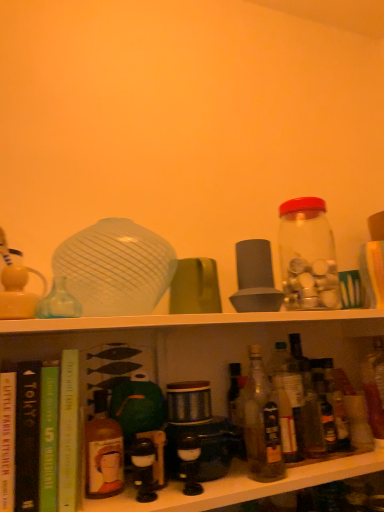
Question: From a real-world perspective, is hardcover book at left, which is counted as the 1th book, starting from the left, under translucent glass bottle at center, which appears as the 2th bottle when viewed from the right?

Choices:
 (A) no
 (B) yes

Answer: (A)

Question: Considering the relative positions of hardcover book at left, which is counted as the 1th book, starting from the left, and translucent glass bottle at center, marked as the fourth bottle in a left-to-right arrangement, in the image provided, is hardcover book at left, which is counted as the 1th book, starting from the left, in front of translucent glass bottle at center, marked as the fourth bottle in a left-to-right arrangement,?

Choices:
 (A) yes
 (B) no

Answer: (A)

Question: Is hardcover book at left, placed as the fourth book when sorted from right to left, oriented towards translucent glass bottle at center, which appears as the 2th bottle when viewed from the right?

Choices:
 (A) yes
 (B) no

Answer: (B)

Question: From the image's perspective, does hardcover book at left, which is counted as the 1th book, starting from the left, appear lower than translucent glass bottle at center, which appears as the 2th bottle when viewed from the right?

Choices:
 (A) yes
 (B) no

Answer: (B)

Question: From a real-world perspective, is hardcover book at left, placed as the fourth book when sorted from right to left, located higher than translucent glass bottle at center, which appears as the 2th bottle when viewed from the right?

Choices:
 (A) yes
 (B) no

Answer: (A)

Question: Does hardcover book at left, placed as the fourth book when sorted from right to left, have a lesser width compared to translucent glass bottle at center, which appears as the 2th bottle when viewed from the right?

Choices:
 (A) yes
 (B) no

Answer: (B)

Question: Would you say black matte book at left, the 2th book in the left-to-right sequence, contains matte white teapot at left?

Choices:
 (A) no
 (B) yes

Answer: (A)

Question: Does black matte book at left, positioned as the third book in right-to-left order, appear on the left side of matte white teapot at left?

Choices:
 (A) yes
 (B) no

Answer: (B)

Question: Can you confirm if black matte book at left, positioned as the third book in right-to-left order, is positioned to the right of matte white teapot at left?

Choices:
 (A) no
 (B) yes

Answer: (B)

Question: From a real-world perspective, does black matte book at left, positioned as the third book in right-to-left order, stand above matte white teapot at left?

Choices:
 (A) yes
 (B) no

Answer: (B)

Question: Is black matte book at left, positioned as the third book in right-to-left order, outside matte white teapot at left?

Choices:
 (A) no
 (B) yes

Answer: (B)

Question: Is black matte book at left, the 2th book in the left-to-right sequence, thinner than matte white teapot at left?

Choices:
 (A) yes
 (B) no

Answer: (B)

Question: Is translucent glass bottle at center, the 3th bottle viewed from the left, not close to hardcover book at center, acting as the fourth book starting from the left?

Choices:
 (A) no
 (B) yes

Answer: (A)